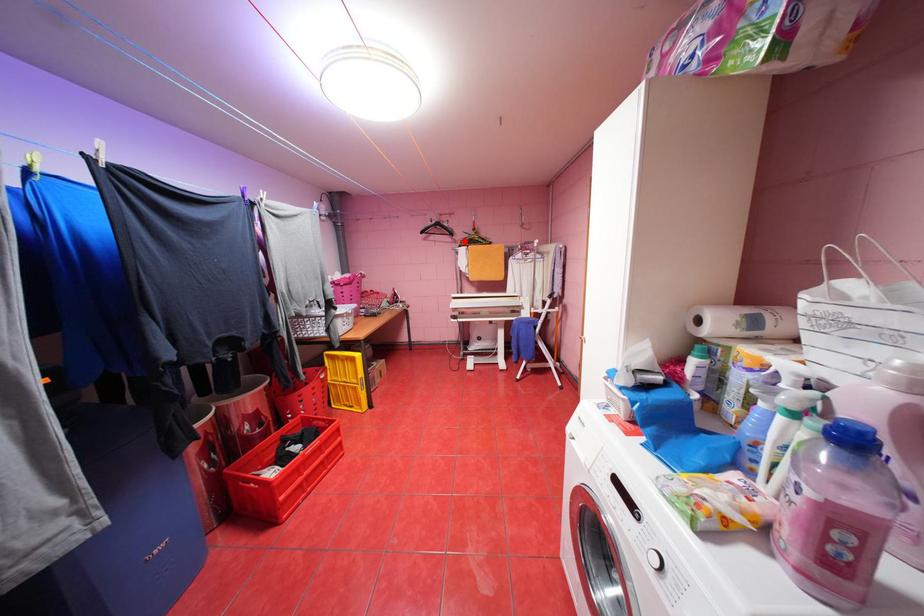
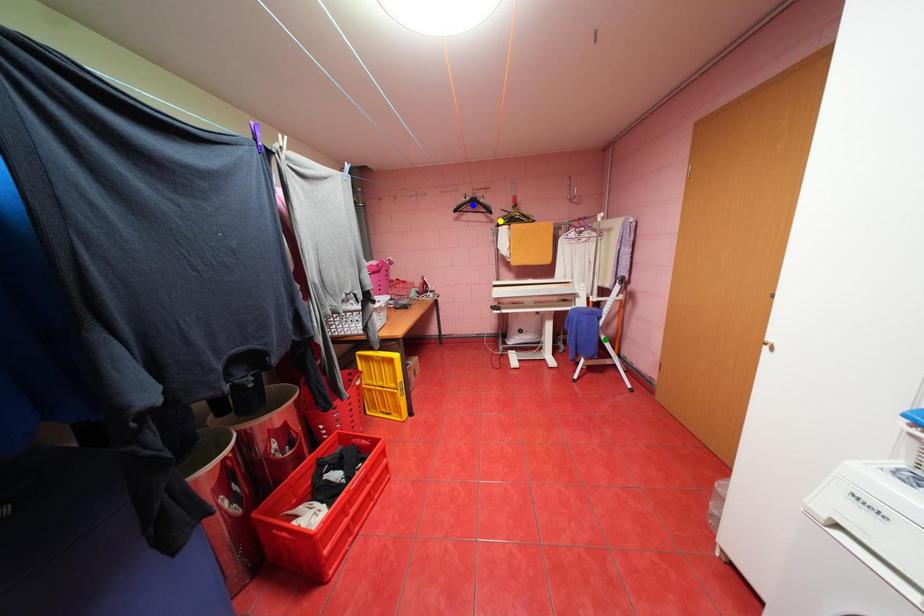
Question: I am providing you with two images of the same scene from different viewpoints. A red point is marked on the first image. You are given multiple points on the second image. Which spot in image 2 lines up with the point in image 1?

Choices:
 (A) yellow point
 (B) green point
 (C) blue point

Answer: (A)